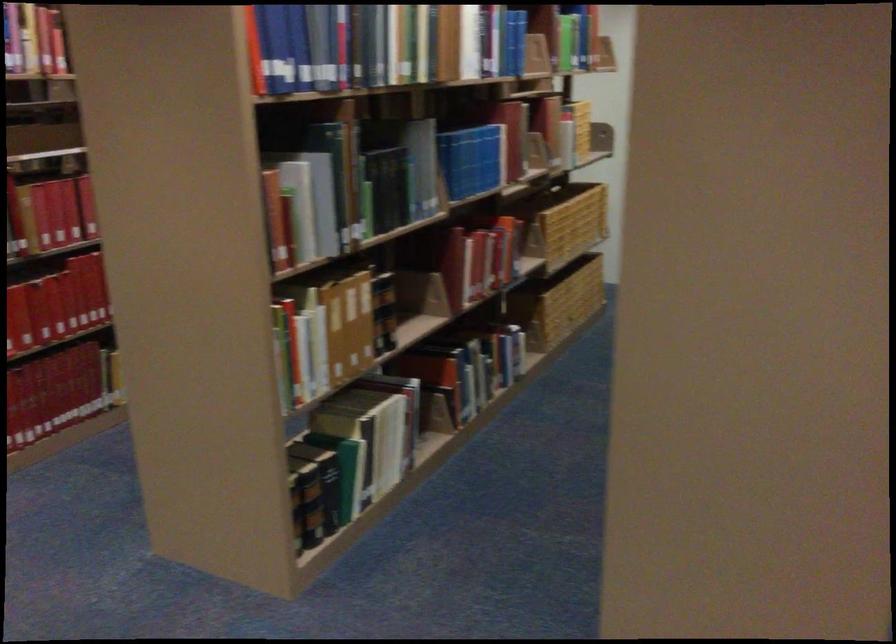
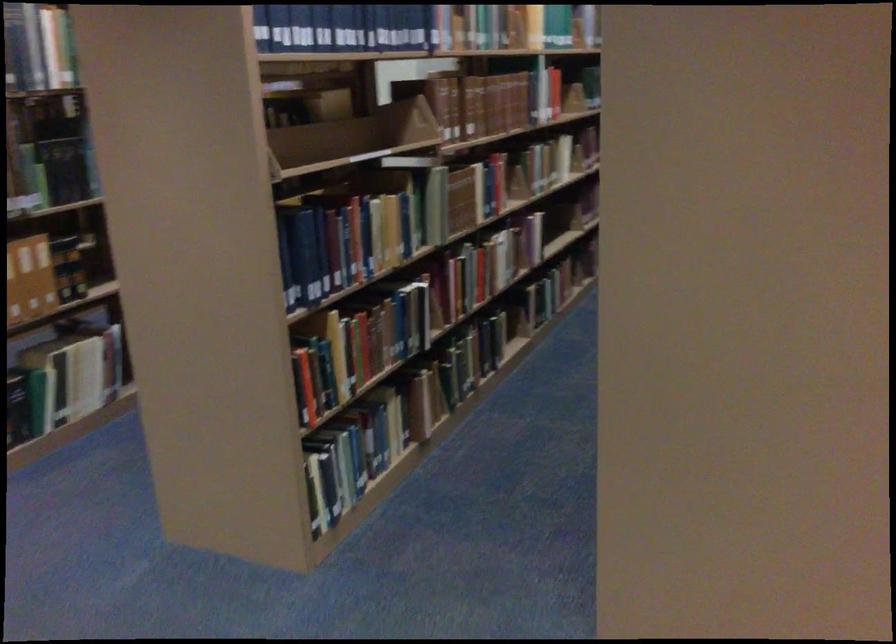
What movement of the cameraman would produce the second image?

The cameraman moved toward right, backward.